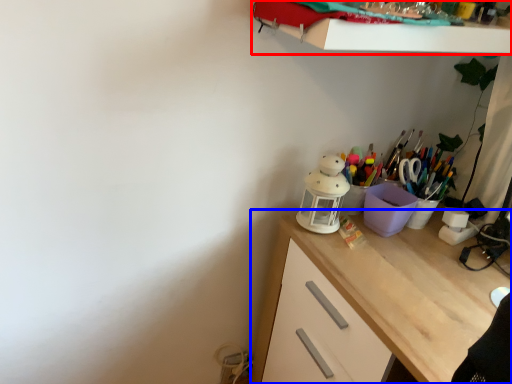
Question: Which object is closer to the camera taking this photo, shelf (highlighted by a red box) or desk (highlighted by a blue box)?

Choices:
 (A) shelf
 (B) desk

Answer: (A)